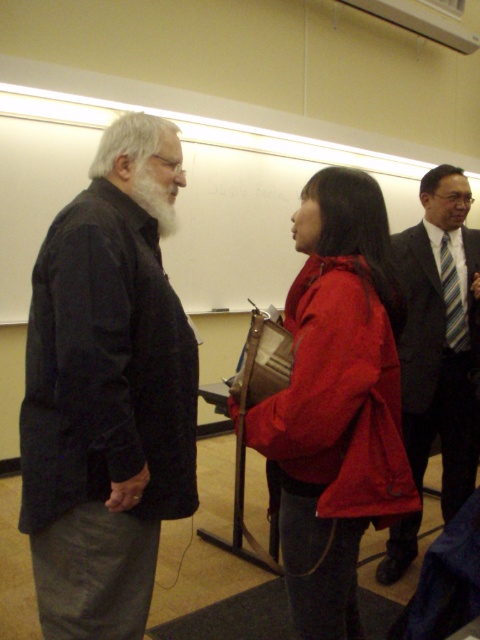
Can you confirm if dark gray fabric jacket at left is thinner than whitehairbeard at left?

In fact, dark gray fabric jacket at left might be wider than whitehairbeard at left.

How distant is dark gray fabric jacket at left from whitehairbeard at left?

dark gray fabric jacket at left is 14.52 inches from whitehairbeard at left.

Does point (145, 384) lie behind point (149, 168)?

No, it is not.

At what (x,y) coordinates should I click in order to perform the action: click on dark gray fabric jacket at left. Please return your answer as a coordinate pair (x, y). The width and height of the screenshot is (480, 640). Looking at the image, I should click on tap(106, 397).

Is point (291, 410) more distant than point (172, 232)?

No, (291, 410) is closer to viewer.

Is matte red jacket at center closer to camera compared to whitehairbeard at left?

Yes.

This screenshot has height=640, width=480. Describe the element at coordinates (337, 400) in the screenshot. I see `matte red jacket at center` at that location.

The image size is (480, 640). Find the location of `matte red jacket at center`. matte red jacket at center is located at coordinates (337, 400).

Who is shorter, dark gray fabric jacket at left or matte red jacket at center?

matte red jacket at center

Is point (88, 541) positioned in front of point (392, 396)?

That is True.

Find the location of a particular element. The height and width of the screenshot is (640, 480). dark gray fabric jacket at left is located at coordinates (106, 397).